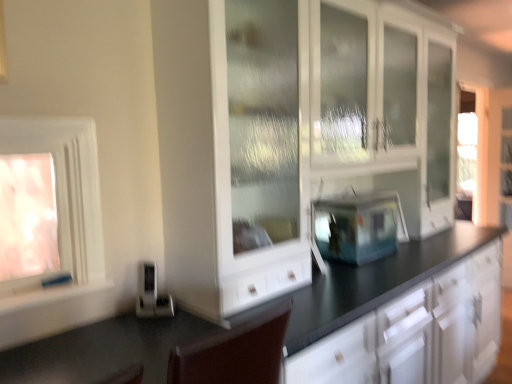
Question: Considering the positions of satin silver toaster at lower left, which appears as the 2th appliance when viewed from the back, and white glossy window at left, placed as the 2th window when sorted from left to right, in the image, is satin silver toaster at lower left, which appears as the 2th appliance when viewed from the back, wider or thinner than white glossy window at left, placed as the 2th window when sorted from left to right,?

Choices:
 (A) thin
 (B) wide

Answer: (A)

Question: Is satin silver toaster at lower left, the first appliance when ordered from front to back, in front of or behind white glossy window at left, marked as the first window in a right-to-left arrangement, in the image?

Choices:
 (A) front
 (B) behind

Answer: (B)

Question: Estimate the real-world distances between objects in this image. Which object is closer to the white matte window sill at lower left?

Choices:
 (A) transparent glass fish tank at center, the second appliance positioned from the front
 (B) satin silver toaster at lower left, the 1th appliance from the left
 (C) translucent glass window at left, which ranks as the second window in right-to-left order
 (D) white glossy cabinet at center
 (E) white glossy window at left, marked as the first window in a right-to-left arrangement

Answer: (E)

Question: Which object is the closest to the white glossy cabinet at center?

Choices:
 (A) satin silver toaster at lower left, which appears as the 2th appliance when viewed from the back
 (B) white glossy window at left, marked as the first window in a right-to-left arrangement
 (C) transparent glass fish tank at center, the second appliance positioned from the front
 (D) white matte window sill at lower left
 (E) translucent glass window at left, positioned as the first window in left-to-right order

Answer: (C)